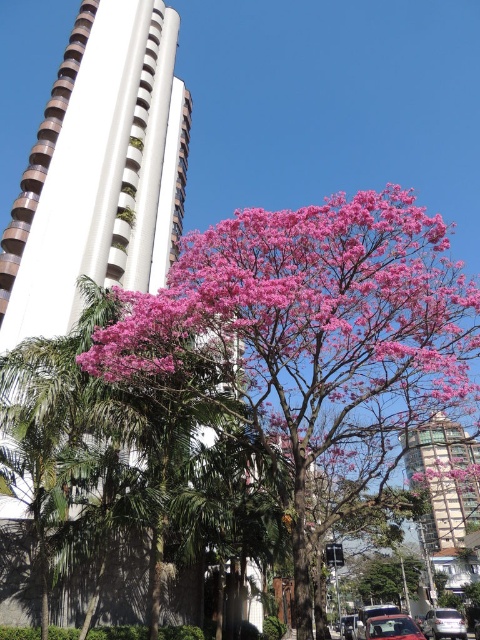
Question: Estimate the real-world distances between objects in this image. Which object is closer to the white glossy car at lower right?

Choices:
 (A) metallic glass building at right
 (B) shiny red car at center
 (C) pink matte flower at center

Answer: (B)

Question: Is the position of pink fluffy tree at center less distant than that of shiny red car at center?

Choices:
 (A) no
 (B) yes

Answer: (B)

Question: Does pink matte flower at center appear on the left side of shiny red car at center?

Choices:
 (A) yes
 (B) no

Answer: (B)

Question: Which point is closer to the camera?

Choices:
 (A) (448, 474)
 (B) (430, 493)

Answer: (A)

Question: Considering the relative positions of pink matte flower at center and shiny red car at center in the image provided, where is pink matte flower at center located with respect to shiny red car at center?

Choices:
 (A) right
 (B) left

Answer: (A)

Question: Which of the following is the farthest from the observer?

Choices:
 (A) (398, 628)
 (B) (457, 547)
 (C) (448, 464)

Answer: (B)